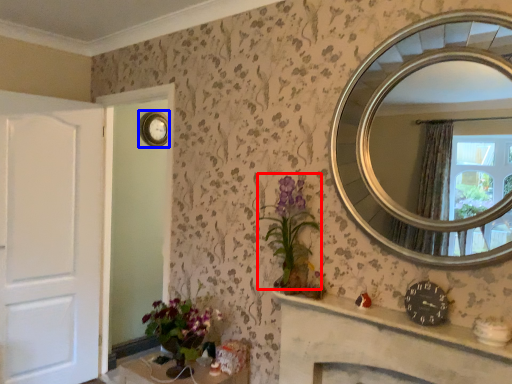
Question: Which object is further to the camera taking this photo, floral arrangement (highlighted by a red box) or clock (highlighted by a blue box)?

Choices:
 (A) floral arrangement
 (B) clock

Answer: (B)